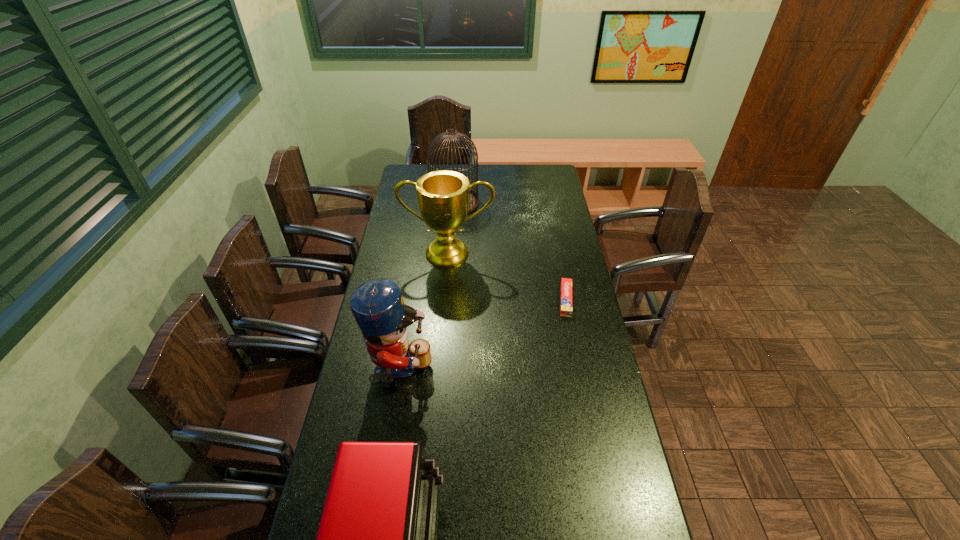
At what (x,y) coordinates should I click in order to perform the action: click on birdcage. Please return your answer as a coordinate pair (x, y). This screenshot has height=540, width=960. Looking at the image, I should click on (473, 196).

Locate an element on the screen. This screenshot has width=960, height=540. award is located at coordinates (443, 196).

You are a GUI agent. You are given a task and a screenshot of the screen. Output one action in this format:
    pyautogui.click(x=<x>, y=<y>)
    Task: Click on the second nearest object
    
    Given the screenshot: What is the action you would take?
    pyautogui.click(x=377, y=305)

I want to click on the third nearest object, so click(x=566, y=284).

The width and height of the screenshot is (960, 540). I want to click on the rightmost object, so click(566, 284).

The height and width of the screenshot is (540, 960). What are the coordinates of `vacant region located on the back of the birdcage` in the screenshot? It's located at (456, 183).

Locate an element on the screen. vacant point located on the shiny surface of the award is located at coordinates (445, 286).

Image resolution: width=960 pixels, height=540 pixels. I want to click on free region located 0.190m on the front-facing side of the nutcracker, so click(x=491, y=372).

Where is `vacant space located 0.110m on the back of the toothpaste`? vacant space located 0.110m on the back of the toothpaste is located at coordinates (559, 265).

Identify the location of award located in the left edge section of the desktop. This screenshot has width=960, height=540. (443, 196).